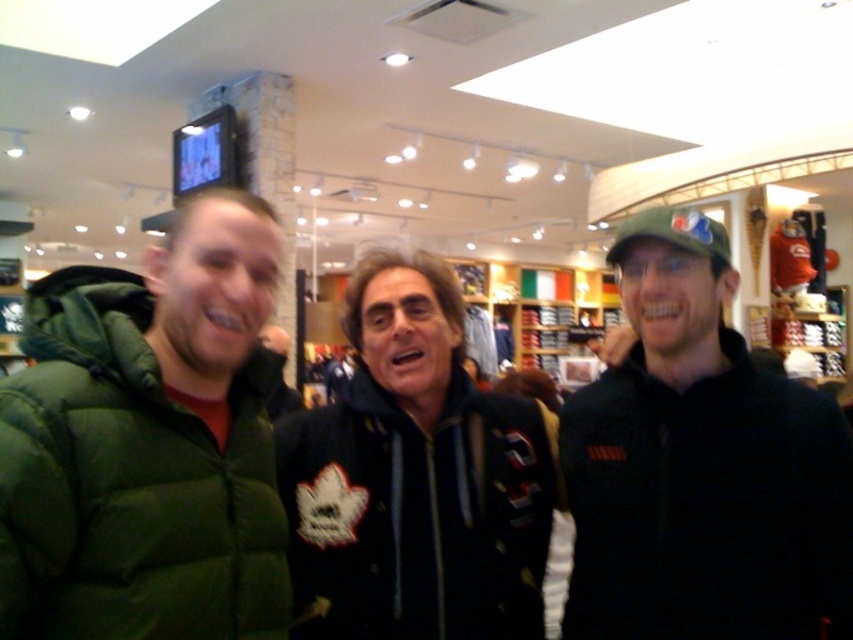
Consider the image. You are a customer in a store and want to try on the black matte jacket at right and the black fleece jacket at center. Which jacket should you reach for first if you want to grab the one that is closer to you?

The black matte jacket at right is closer to the viewer than the black fleece jacket at center, so you should reach for the black matte jacket at right first.

Based on the photo, you are a store employee who needs to hang a new price tag on a rack that is 1.8 meters tall. You are wearing a green puffy jacket at left and a black fleece jacket at center. Which jacket should you wear to reach the top of the rack without a ladder?

The green puffy jacket at left is much taller than the black fleece jacket at center, so you should wear the green puffy jacket at left to reach the top of the 1.8 meter rack without needing a ladder.

Consider the image. You are trying to decide between two jackets in a store. You notice the black matte jacket at right and the black fleece jacket at center. Which one is taller?

The black matte jacket at right is taller than the black fleece jacket at center.